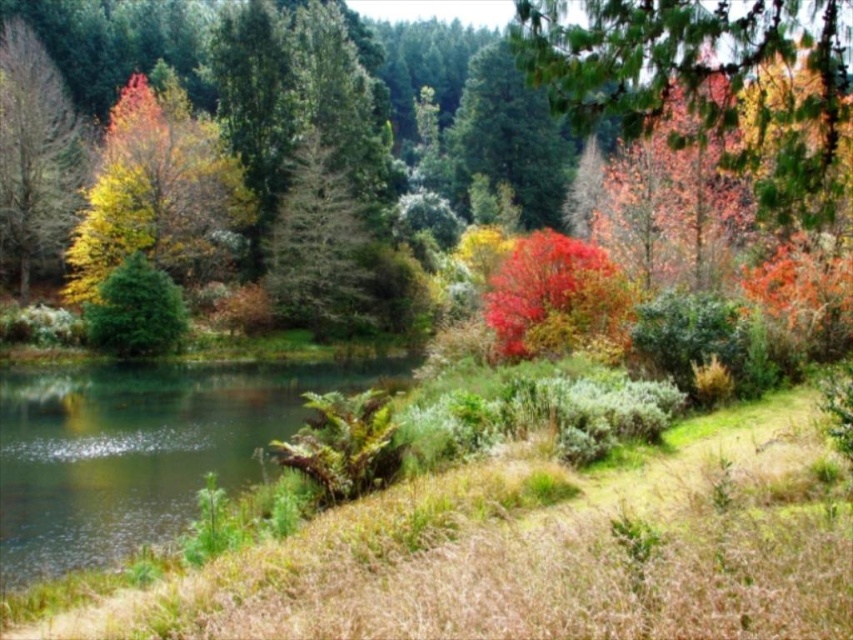
You are standing at the center of the grassy area in the foreground of the scene. You see two points marked in the image. Which point is closer to you, point [161,173] or point [70,122]?

Point [161,173] is in front of point [70,122], so it is closer to you.